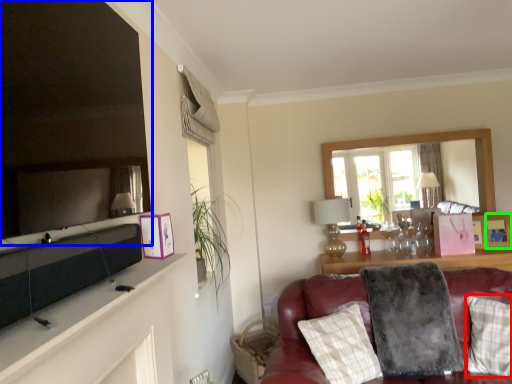
Question: Considering the real-world distances, which object is farthest from pillow (highlighted by a red box)? mirror (highlighted by a blue box) or picture frame (highlighted by a green box)?

Choices:
 (A) mirror
 (B) picture frame

Answer: (A)